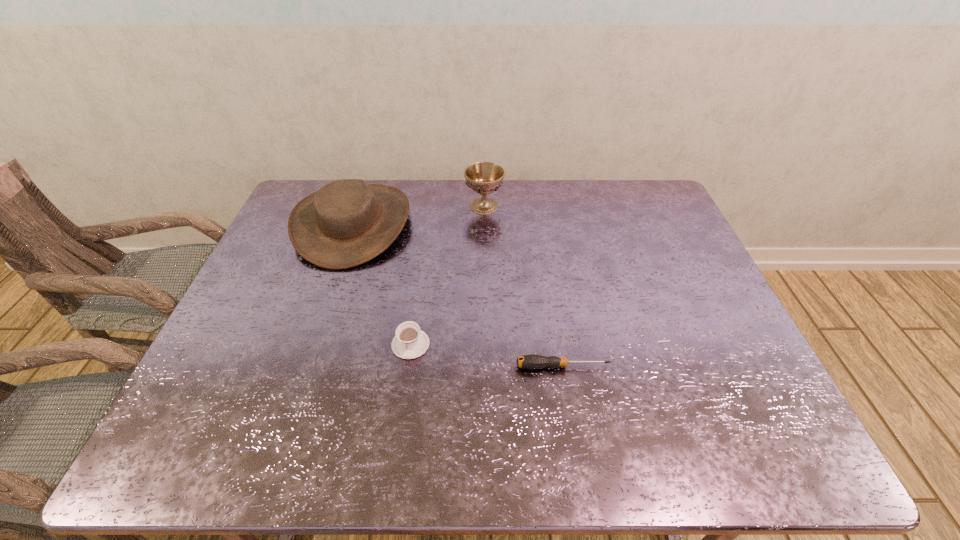
At what (x,y) coordinates should I click in order to perform the action: click on the leftmost object. Please return your answer as a coordinate pair (x, y). Looking at the image, I should click on (346, 223).

Where is `the third object from left to right`? the third object from left to right is located at coordinates (484, 178).

Locate an element on the screen. Image resolution: width=960 pixels, height=540 pixels. the third object from right to left is located at coordinates (410, 342).

At what (x,y) coordinates should I click in order to perform the action: click on teacup. Please return your answer as a coordinate pair (x, y). Looking at the image, I should click on (410, 342).

This screenshot has width=960, height=540. What are the coordinates of `screwdriver` in the screenshot? It's located at (532, 361).

The image size is (960, 540). I want to click on the nearest object, so click(x=532, y=361).

Where is `vacant space located 0.350m on the right of the cowboy hat`? The width and height of the screenshot is (960, 540). vacant space located 0.350m on the right of the cowboy hat is located at coordinates (519, 224).

The width and height of the screenshot is (960, 540). In order to click on vacant region located on the back of the third object from left to right in this screenshot , I will do `click(484, 180)`.

What are the coordinates of `free space located 0.230m on the handle side of the second object from left to right` in the screenshot? It's located at (395, 456).

Where is `vacant area situated 0.080m on the back of the shortest object`? This screenshot has width=960, height=540. vacant area situated 0.080m on the back of the shortest object is located at coordinates (558, 334).